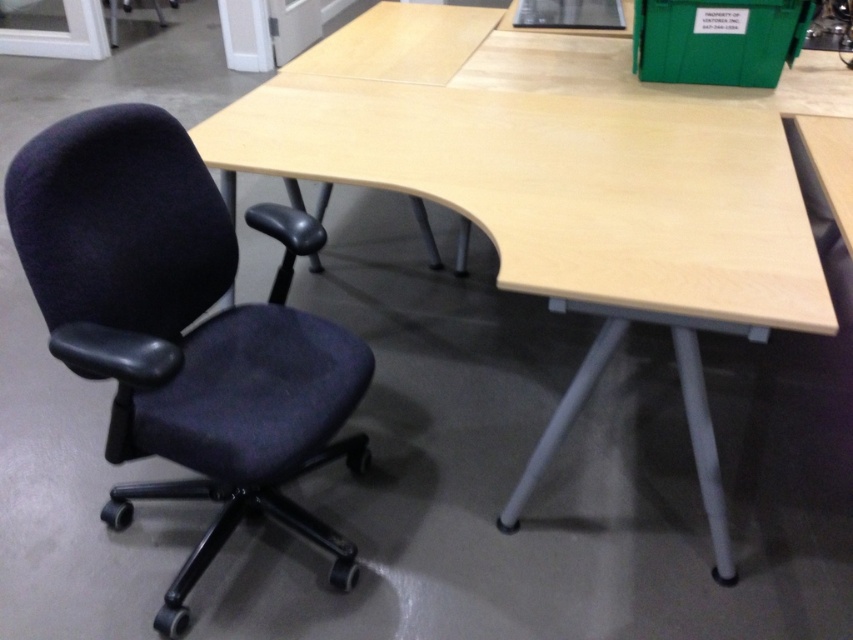
Does light wood/wooden table at center have a greater height compared to dark blue fabric swivel chair at left?

Correct, light wood/wooden table at center is much taller as dark blue fabric swivel chair at left.

Who is shorter, light wood/wooden table at center or dark blue fabric swivel chair at left?

With less height is dark blue fabric swivel chair at left.

Which is behind, point (717, 232) or point (114, 408)?

Point (717, 232)

You are a GUI agent. You are given a task and a screenshot of the screen. Output one action in this format:
    pyautogui.click(x=<x>, y=<y>)
    Task: Click on the light wood/wooden table at center
    
    Given the screenshot: What is the action you would take?
    pyautogui.click(x=554, y=195)